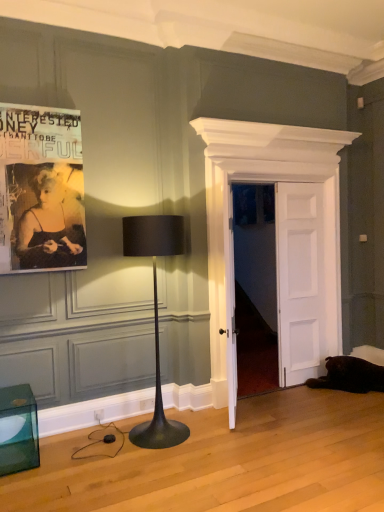
Question: Is point (289, 379) closer or farther from the camera than point (334, 262)?

Choices:
 (A) farther
 (B) closer

Answer: (B)

Question: From a real-world perspective, is white wooden door at center, which is the first door from right to left, positioned above or below white wooden door at center, the first door when ordered from left to right?

Choices:
 (A) above
 (B) below

Answer: (B)

Question: Considering the real-world distances, which object is farthest from the black paper poster at upper left?

Choices:
 (A) white wooden door at center, which ranks as the second door in right-to-left order
 (B) matte black lamp at center-left
 (C) transparent glass cube at lower left
 (D) white wooden door at center, which is the 2th door in left-to-right order

Answer: (D)

Question: Considering the real-world distances, which object is farthest from the matte black lamp at center-left?

Choices:
 (A) white wooden door at center, the first door when ordered from left to right
 (B) white wooden door at center, which is the first door from right to left
 (C) black paper poster at upper left
 (D) transparent glass cube at lower left

Answer: (B)